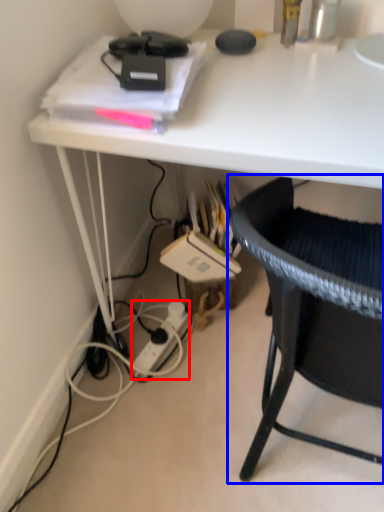
Question: Which object appears farthest to the camera in this image, power outlet (highlighted by a red box) or chair (highlighted by a blue box)?

Choices:
 (A) power outlet
 (B) chair

Answer: (A)